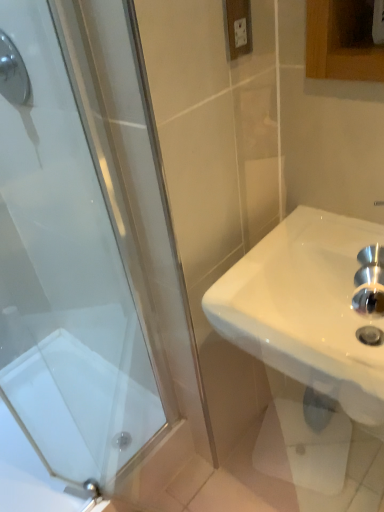
Question: Should I look upward or downward to see white glossy sink at right?

Choices:
 (A) down
 (B) up

Answer: (A)

Question: Considering the relative sizes of white glossy bath at lower left and shiny chrome showerhead at upper left in the image provided, is white glossy bath at lower left thinner than shiny chrome showerhead at upper left?

Choices:
 (A) no
 (B) yes

Answer: (A)

Question: From a real-world perspective, is white glossy bath at lower left below shiny chrome showerhead at upper left?

Choices:
 (A) no
 (B) yes

Answer: (B)

Question: Can shiny chrome showerhead at upper left be found inside white glossy bath at lower left?

Choices:
 (A) yes
 (B) no

Answer: (B)

Question: From the image's perspective, would you say white glossy bath at lower left is shown under shiny chrome showerhead at upper left?

Choices:
 (A) yes
 (B) no

Answer: (A)

Question: Considering the relative positions of white glossy bath at lower left and shiny chrome showerhead at upper left in the image provided, is white glossy bath at lower left behind shiny chrome showerhead at upper left?

Choices:
 (A) no
 (B) yes

Answer: (B)

Question: Is white glossy bath at lower left looking in the opposite direction of shiny chrome showerhead at upper left?

Choices:
 (A) no
 (B) yes

Answer: (A)

Question: Is white plastic electric outlet at upper center located within white glossy bath at lower left?

Choices:
 (A) yes
 (B) no

Answer: (B)

Question: From a real-world perspective, is white glossy bath at lower left on top of white plastic electric outlet at upper center?

Choices:
 (A) no
 (B) yes

Answer: (A)

Question: Is white glossy bath at lower left located outside white plastic electric outlet at upper center?

Choices:
 (A) no
 (B) yes

Answer: (B)

Question: Can you confirm if white glossy bath at lower left is shorter than white plastic electric outlet at upper center?

Choices:
 (A) no
 (B) yes

Answer: (B)

Question: From a real-world perspective, is white glossy bath at lower left located beneath white plastic electric outlet at upper center?

Choices:
 (A) yes
 (B) no

Answer: (A)

Question: Is white glossy bath at lower left touching white plastic electric outlet at upper center?

Choices:
 (A) no
 (B) yes

Answer: (A)

Question: Would you say white plastic electric outlet at upper center is outside shiny chrome showerhead at upper left?

Choices:
 (A) no
 (B) yes

Answer: (B)